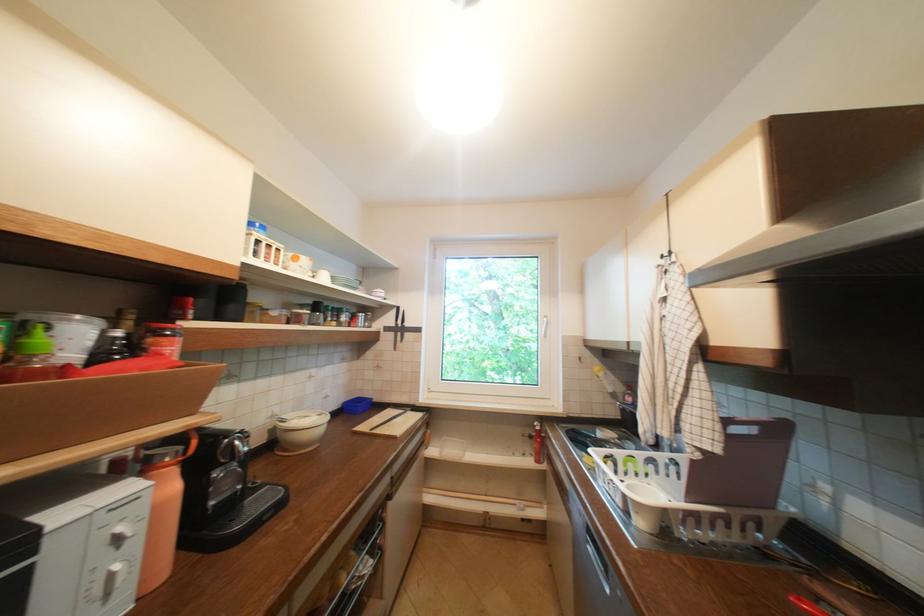
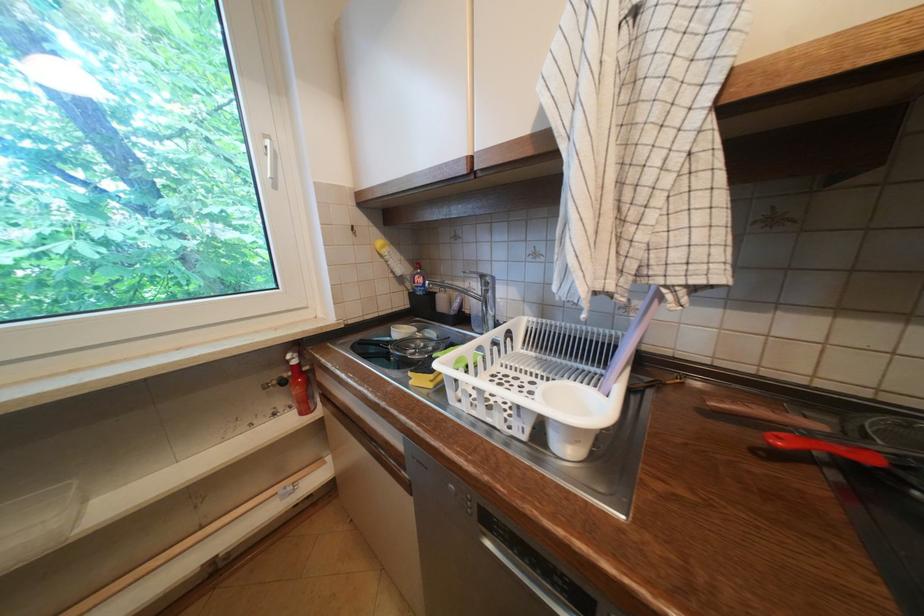
Question: I am providing you with two images of the same scene from different viewpoints. Which of the following objects are not visible in image2?

Choices:
 (A) faucet handle
 (B) white window handle
 (C) dishwasher handle
 (D) none of these

Answer: (D)